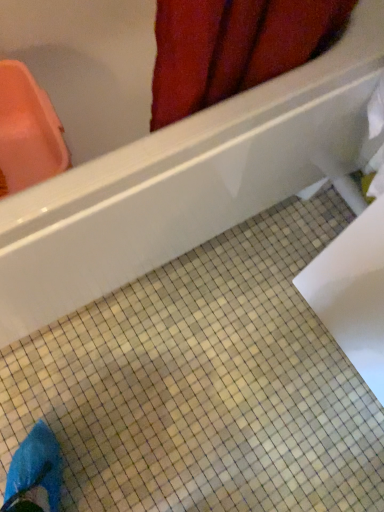
Describe the element at coordinates (205, 384) in the screenshot. This screenshot has width=384, height=512. I see `white glossy ceramic tile at center` at that location.

At what (x,y) coordinates should I click in order to perform the action: click on white glossy ceramic tile at center. Please return your answer as a coordinate pair (x, y). Looking at the image, I should click on (205, 384).

This screenshot has height=512, width=384. What do you see at coordinates (183, 183) in the screenshot?
I see `white glossy bathtub at upper center` at bounding box center [183, 183].

Locate an element on the screen. Image resolution: width=384 pixels, height=512 pixels. white glossy bathtub at upper center is located at coordinates (183, 183).

At what (x,y) coordinates should I click in order to perform the action: click on white glossy ceramic tile at center. Please return your answer as a coordinate pair (x, y). This screenshot has width=384, height=512. Looking at the image, I should click on (205, 384).

In the scene shown: Can you confirm if white glossy ceramic tile at center is positioned to the left of white glossy bathtub at upper center?

Incorrect, white glossy ceramic tile at center is not on the left side of white glossy bathtub at upper center.

Is white glossy ceramic tile at center positioned in front of white glossy bathtub at upper center?

No, it is not.

Which is behind, point (241, 504) or point (64, 96)?

Positioned behind is point (64, 96).

From the image's perspective, which is above, white glossy ceramic tile at center or white glossy bathtub at upper center?

white glossy bathtub at upper center is shown above in the image.

From a real-world perspective, between white glossy ceramic tile at center and white glossy bathtub at upper center, who is vertically lower?

In real-world perspective, white glossy ceramic tile at center is lower.

Looking at their sizes, would you say white glossy ceramic tile at center is wider or thinner than white glossy bathtub at upper center?

In the image, white glossy ceramic tile at center appears to be wider than white glossy bathtub at upper center.

Can you confirm if white glossy ceramic tile at center is shorter than white glossy bathtub at upper center?

Indeed, white glossy ceramic tile at center has a lesser height compared to white glossy bathtub at upper center.

Looking at the image, does white glossy ceramic tile at center seem bigger or smaller compared to white glossy bathtub at upper center?

Considering their sizes, white glossy ceramic tile at center takes up less space than white glossy bathtub at upper center.

Can white glossy bathtub at upper center be found inside white glossy ceramic tile at center?

No, white glossy bathtub at upper center is located outside of white glossy ceramic tile at center.

Are white glossy ceramic tile at center and white glossy bathtub at upper center making contact?

There is a gap between white glossy ceramic tile at center and white glossy bathtub at upper center.

Is white glossy bathtub at upper center at the back of white glossy ceramic tile at center?

No, white glossy ceramic tile at center is not facing the opposite direction of white glossy bathtub at upper center.

This screenshot has width=384, height=512. I want to click on ceramic tile that appears below the white glossy bathtub at upper center (from a real-world perspective), so click(x=205, y=384).

Considering the relative positions of white glossy bathtub at upper center and white glossy ceramic tile at center in the image provided, is white glossy bathtub at upper center to the left or to the right of white glossy ceramic tile at center?

white glossy bathtub at upper center is to the left of white glossy ceramic tile at center.

Is white glossy bathtub at upper center further to the viewer compared to white glossy ceramic tile at center?

No, it is in front of white glossy ceramic tile at center.

Which point is more forward, (251, 175) or (275, 326)?

Point (251, 175)

Looking at this image, from the image's perspective, is white glossy bathtub at upper center positioned above or below white glossy ceramic tile at center?

white glossy bathtub at upper center is situated higher than white glossy ceramic tile at center in the image.

Looking at this image, from a real-world perspective, is white glossy bathtub at upper center positioned over white glossy ceramic tile at center based on gravity?

Yes, from a real-world perspective, white glossy bathtub at upper center is on top of white glossy ceramic tile at center.

Considering the relative sizes of white glossy bathtub at upper center and white glossy ceramic tile at center in the image provided, is white glossy bathtub at upper center thinner than white glossy ceramic tile at center?

Yes, white glossy bathtub at upper center is thinner than white glossy ceramic tile at center.

From the picture: Does white glossy bathtub at upper center have a lesser height compared to white glossy ceramic tile at center?

No.

In the scene shown: Considering the relative sizes of white glossy bathtub at upper center and white glossy ceramic tile at center in the image provided, is white glossy bathtub at upper center smaller than white glossy ceramic tile at center?

Incorrect, white glossy bathtub at upper center is not smaller in size than white glossy ceramic tile at center.

Choose the correct answer: Is white glossy bathtub at upper center inside white glossy ceramic tile at center or outside it?

white glossy bathtub at upper center is located beyond the bounds of white glossy ceramic tile at center.

Is white glossy bathtub at upper center with white glossy ceramic tile at center?

No, white glossy bathtub at upper center is not making contact with white glossy ceramic tile at center.

Is white glossy bathtub at upper center looking in the opposite direction of white glossy ceramic tile at center?

That's not correct — white glossy bathtub at upper center is not looking away from white glossy ceramic tile at center.

Where is `bathtub that appears above the white glossy ceramic tile at center (from the image's perspective)`? The image size is (384, 512). bathtub that appears above the white glossy ceramic tile at center (from the image's perspective) is located at coordinates (183, 183).

You are a GUI agent. You are given a task and a screenshot of the screen. Output one action in this format:
    pyautogui.click(x=<x>, y=<y>)
    Task: Click on the ceramic tile on the right of white glossy bathtub at upper center
    
    Given the screenshot: What is the action you would take?
    pyautogui.click(x=205, y=384)

At what (x,y) coordinates should I click in order to perform the action: click on bathtub that appears above the white glossy ceramic tile at center (from the image's perspective). Please return your answer as a coordinate pair (x, y). Looking at the image, I should click on (183, 183).